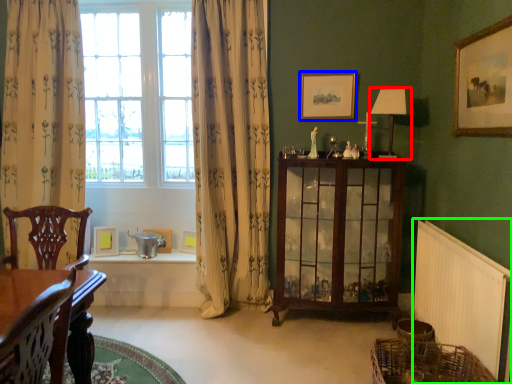
Question: Estimate the real-world distances between objects in this image. Which object is farther from lamp (highlighted by a red box), picture frame (highlighted by a blue box) or radiator (highlighted by a green box)?

Choices:
 (A) picture frame
 (B) radiator

Answer: (B)